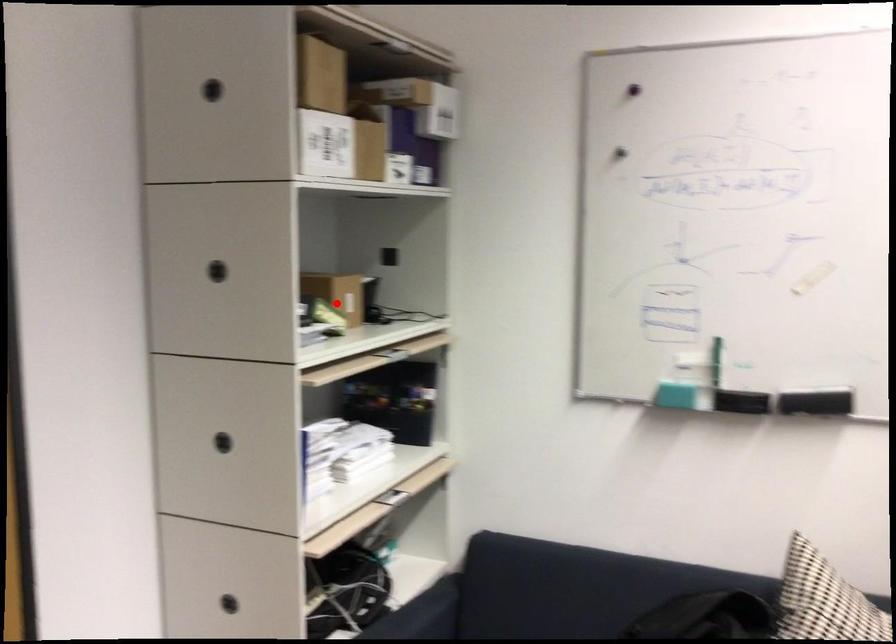
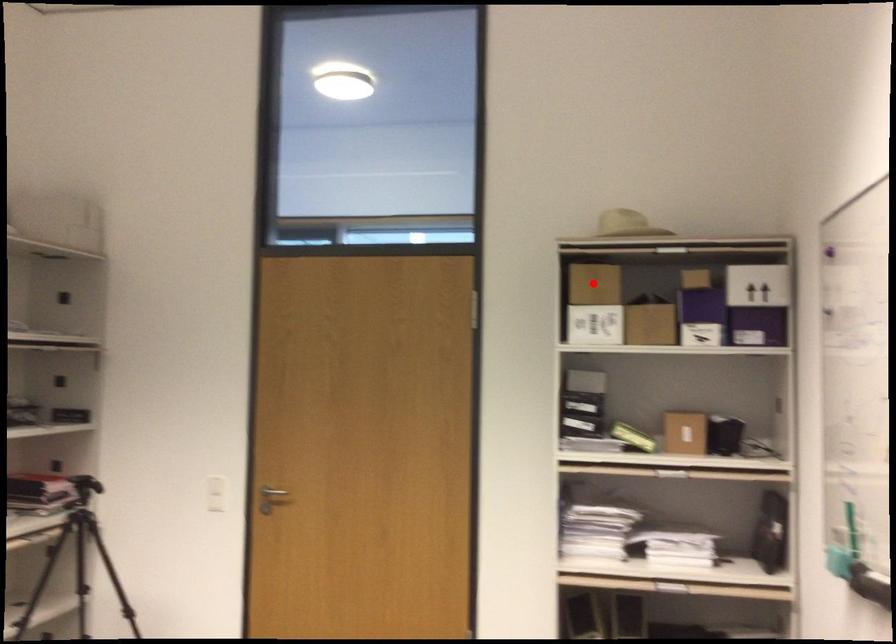
Consider the image. I am providing you with two images of the same scene from different viewpoints. A red point is marked on the first image and another point is marked on the second image. Are the points marked in image1 and image2 representing the same 3D position?

No